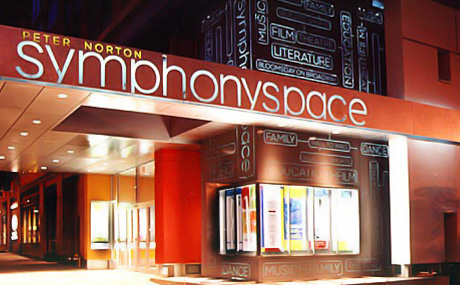
Locate an element on the screen. window is located at coordinates (441, 59).